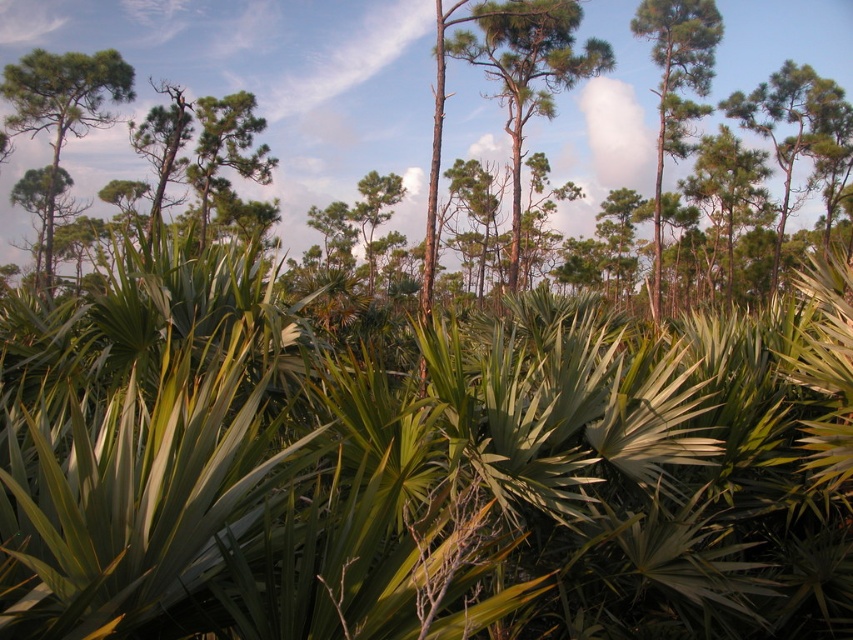
Can you confirm if green textured pine tree at center is smaller than green matte tree at upper left?

No.

Which of these two, green textured pine tree at center or green matte tree at upper left, stands shorter?

green matte tree at upper left

Is point (543, 24) positioned after point (91, 109)?

No, (543, 24) is in front of (91, 109).

Find the location of a particular element. The width and height of the screenshot is (853, 640). green textured pine tree at center is located at coordinates (527, 70).

Can you confirm if green matte tree at upper left is shorter than green matte tree at upper right?

Yes.

Consider the image. Who is positioned more to the right, green matte tree at upper left or green matte tree at upper right?

green matte tree at upper right is more to the right.

This screenshot has height=640, width=853. What are the coordinates of `green matte tree at upper left` in the screenshot? It's located at (62, 106).

Identify the location of green matte tree at upper left. This screenshot has height=640, width=853. (62, 106).

Who is higher up, green textured pine tree at center or green matte tree at upper right?

green matte tree at upper right

Does green textured pine tree at center have a greater width compared to green matte tree at upper right?

Incorrect, green textured pine tree at center's width does not surpass green matte tree at upper right's.

Is point (592, 67) farther from camera compared to point (694, 81)?

No.

In order to click on green textured pine tree at center in this screenshot , I will do `click(527, 70)`.